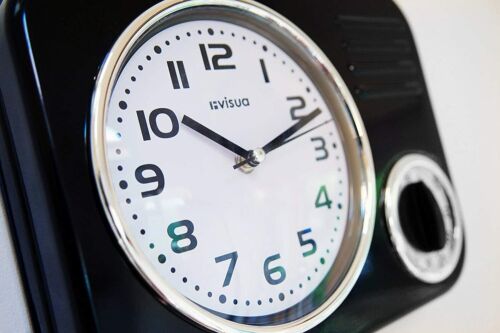
At what (x,y) coordinates should I click in order to perform the action: click on knob. Please return your answer as a coordinate pair (x, y). The width and height of the screenshot is (500, 333). Looking at the image, I should click on [429, 234].